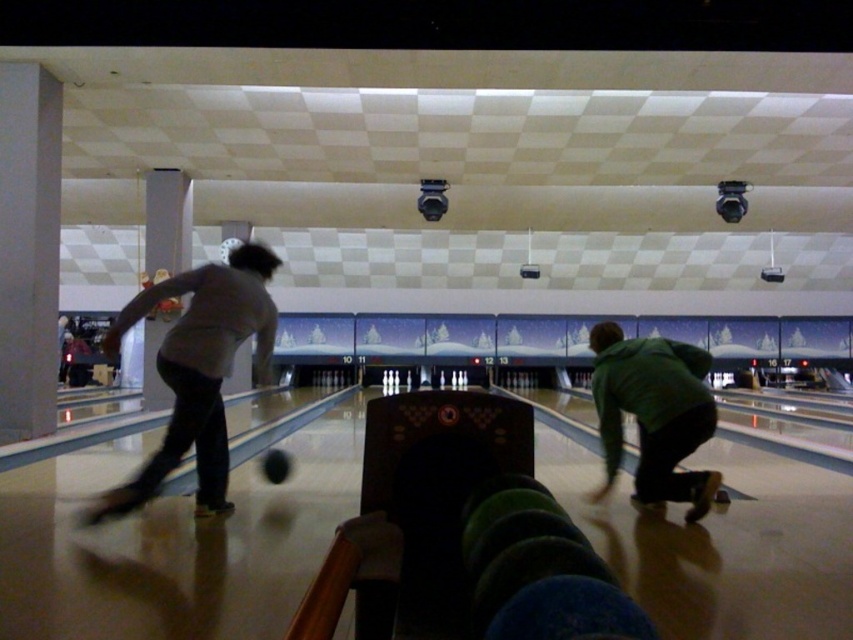
You are a delivery robot with a 2 meter long package. You need to move from the gray fabric shirt at left to the green matte jacket at lower right. Can you fit the package between them without tilting it?

The distance between the gray fabric shirt at left and the green matte jacket at lower right is 2.41 meters, so yes, the robot can fit the 2 meter long package between them as there is enough space.

You are a photographer standing at the entrance of the bowling alley. You want to take a photo of the gray fabric shirt at left and the shiny black bowling ball at center. Which object should you focus on first if you want to capture both in focus without moving the camera?

The gray fabric shirt at left should be focused on first because it is closer to the camera than the shiny black bowling ball at center, allowing both to be in focus with a single focal point.

Where is the gray fabric shirt at left located in the image?

The gray fabric shirt at left is located at point 0.580 on the x axis and 0.234 on the y axis.